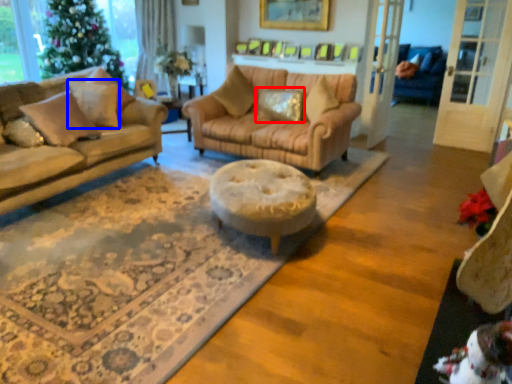
Question: Which object is closer to the camera taking this photo, pillow (highlighted by a red box) or pillow (highlighted by a blue box)?

Choices:
 (A) pillow
 (B) pillow

Answer: (B)